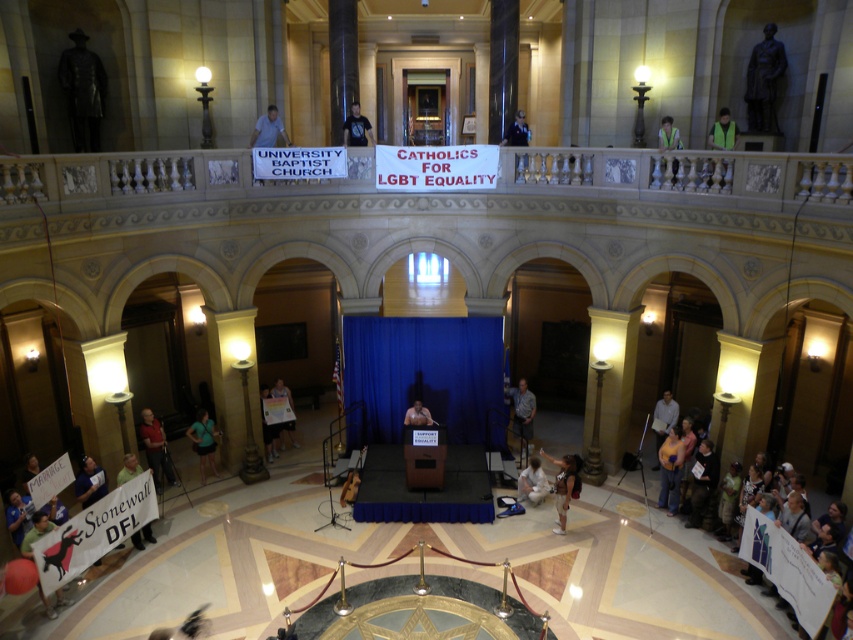
Is point (659, 502) positioned before point (195, 432)?

Yes, it is in front of point (195, 432).

You are a GUI agent. You are given a task and a screenshot of the screen. Output one action in this format:
    pyautogui.click(x=<x>, y=<y>)
    Task: Click on the matte purple shirt at lower right
    Image resolution: width=853 pixels, height=640 pixels.
    Given the screenshot: What is the action you would take?
    pyautogui.click(x=670, y=470)

Locate an element on the screen. Image resolution: width=853 pixels, height=640 pixels. matte purple shirt at lower right is located at coordinates (670, 470).

Does red shirt at lower left appear on the left side of white fabric person at center?

Yes, red shirt at lower left is to the left of white fabric person at center.

Is red shirt at lower left bigger than white fabric person at center?

Yes, red shirt at lower left is bigger than white fabric person at center.

What do you see at coordinates (155, 448) in the screenshot? I see `red shirt at lower left` at bounding box center [155, 448].

Where is `red shirt at lower left`? red shirt at lower left is located at coordinates (155, 448).

Looking at this image, is blue fabric curtain at center closer to the viewer compared to light brown leather jacket at lower right?

No, it is behind light brown leather jacket at lower right.

Is blue fabric curtain at center thinner than light brown leather jacket at lower right?

In fact, blue fabric curtain at center might be wider than light brown leather jacket at lower right.

Identify the location of blue fabric curtain at center. This screenshot has height=640, width=853. (426, 374).